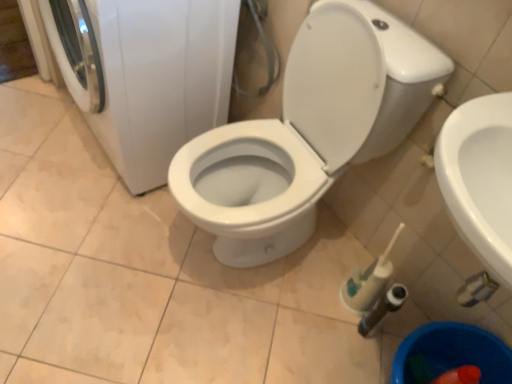
Question: Relative to white glossy washing machine at left, is white glossy toilet at center in front or behind?

Choices:
 (A) behind
 (B) front

Answer: (B)

Question: Considering the positions of point (250, 198) and point (204, 66), is point (250, 198) closer or farther from the camera than point (204, 66)?

Choices:
 (A) farther
 (B) closer

Answer: (A)

Question: In terms of size, does white glossy toilet at center appear bigger or smaller than white glossy washing machine at left?

Choices:
 (A) small
 (B) big

Answer: (A)

Question: From their relative heights in the image, would you say white glossy washing machine at left is taller or shorter than white glossy toilet at center?

Choices:
 (A) tall
 (B) short

Answer: (B)

Question: In terms of size, does white glossy washing machine at left appear bigger or smaller than white glossy toilet at center?

Choices:
 (A) big
 (B) small

Answer: (A)

Question: Relative to white glossy toilet at center, is white glossy washing machine at left in front or behind?

Choices:
 (A) front
 (B) behind

Answer: (B)

Question: From a real-world perspective, is white glossy washing machine at left positioned above or below white glossy toilet at center?

Choices:
 (A) above
 (B) below

Answer: (B)